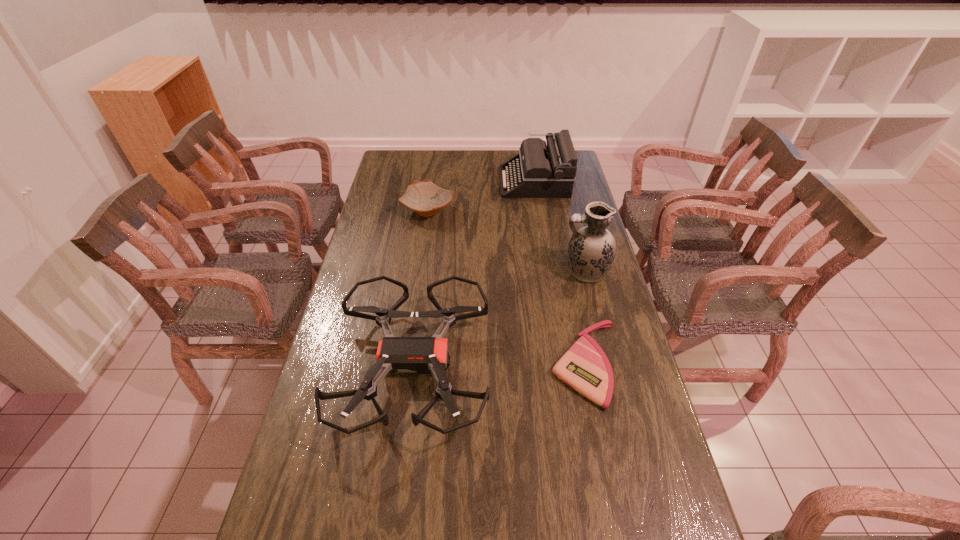
The width and height of the screenshot is (960, 540). Find the location of `vacant space located on the typing side of the second tallest object`. vacant space located on the typing side of the second tallest object is located at coordinates (425, 181).

Identify the location of free location located on the typing side of the second tallest object. This screenshot has width=960, height=540. (432, 181).

This screenshot has height=540, width=960. I want to click on vacant space located with the camera facing forward on the drone, so click(397, 488).

Find the location of `free space located 0.320m on the back of the pottery`. free space located 0.320m on the back of the pottery is located at coordinates tap(435, 159).

Locate an element on the screen. The width and height of the screenshot is (960, 540). vacant space located 0.390m on the back of the wristlet is located at coordinates (562, 245).

Locate an element on the screen. The image size is (960, 540). object positioned at the far edge is located at coordinates (539, 171).

This screenshot has width=960, height=540. Identify the location of drone located at the left edge. (425, 355).

Locate an element on the screen. The image size is (960, 540). pottery that is at the left edge is located at coordinates (425, 198).

In order to click on vase present at the right edge in this screenshot , I will do `click(592, 249)`.

Locate an element on the screen. Image resolution: width=960 pixels, height=540 pixels. typewriter at the right edge is located at coordinates (539, 171).